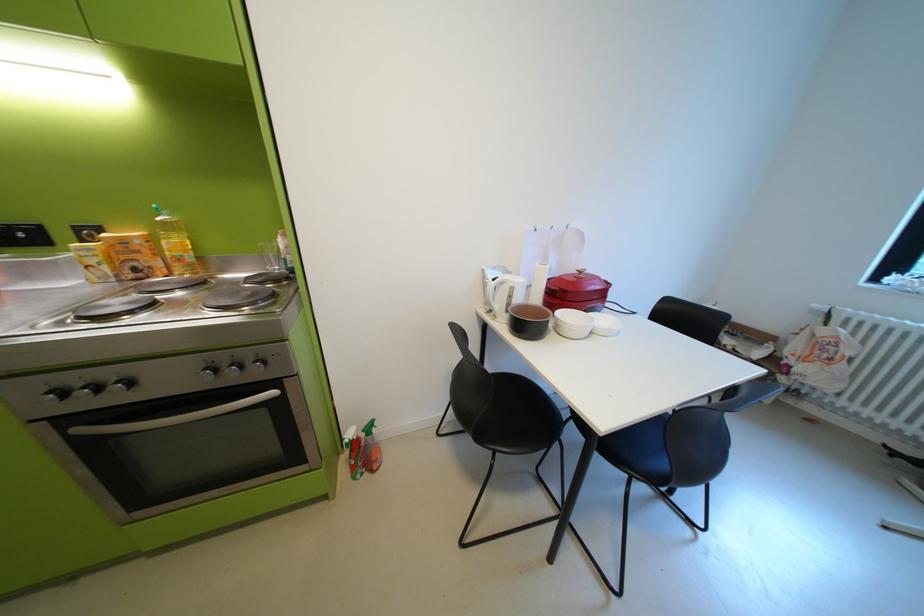
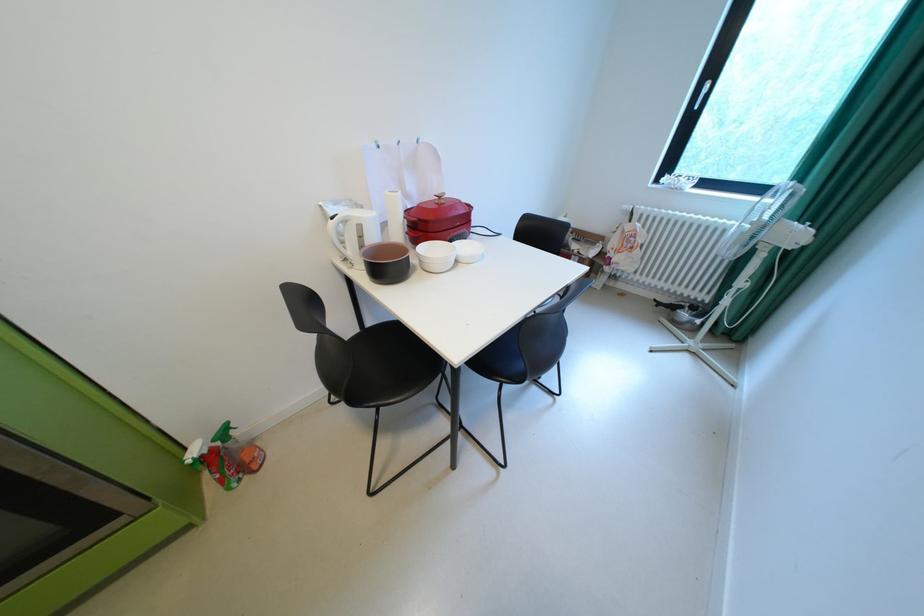
The point at (590, 273) is marked in the first image. Where is the corresponding point in the second image?

(450, 198)